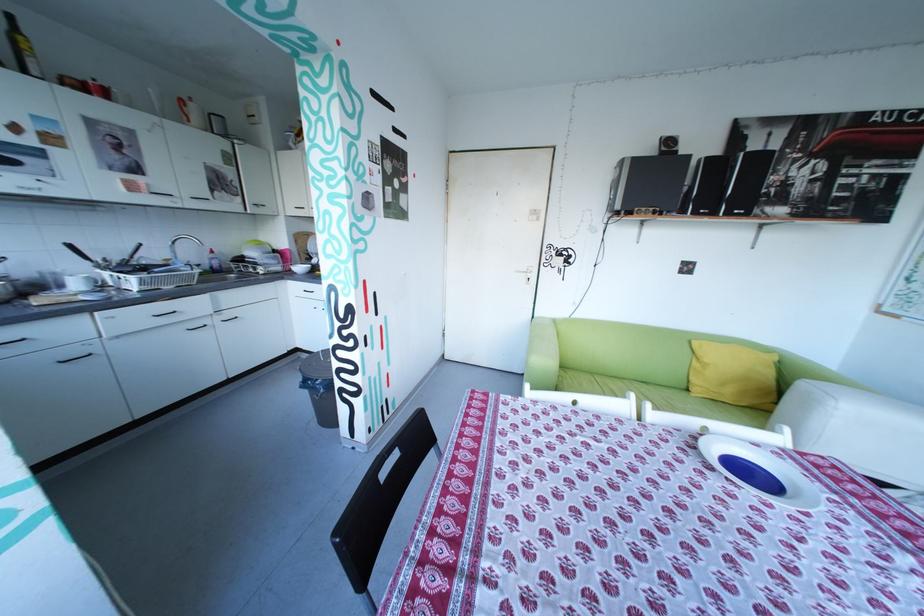
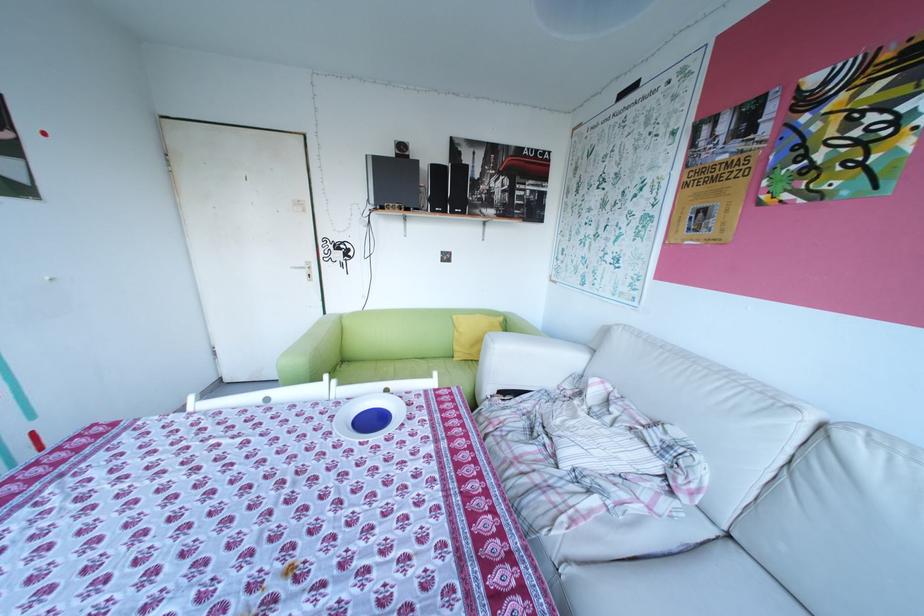
Question: In a continuous first-person perspective shot, in which direction is the camera moving?

Choices:
 (A) Left
 (B) Right
 (C) Forward
 (D) Backward

Answer: (B)